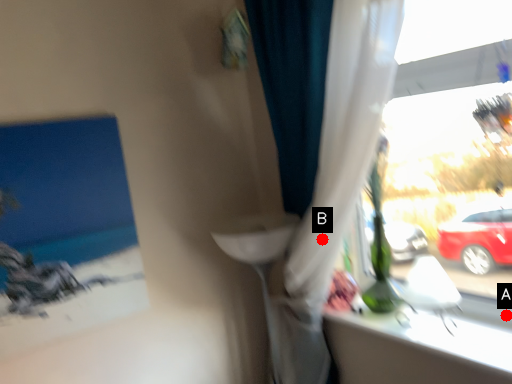
Question: Two points are circled on the image, labeled by A and B beside each circle. Which of the following is the closest to the observer?

Choices:
 (A) A is closer
 (B) B is closer

Answer: (B)